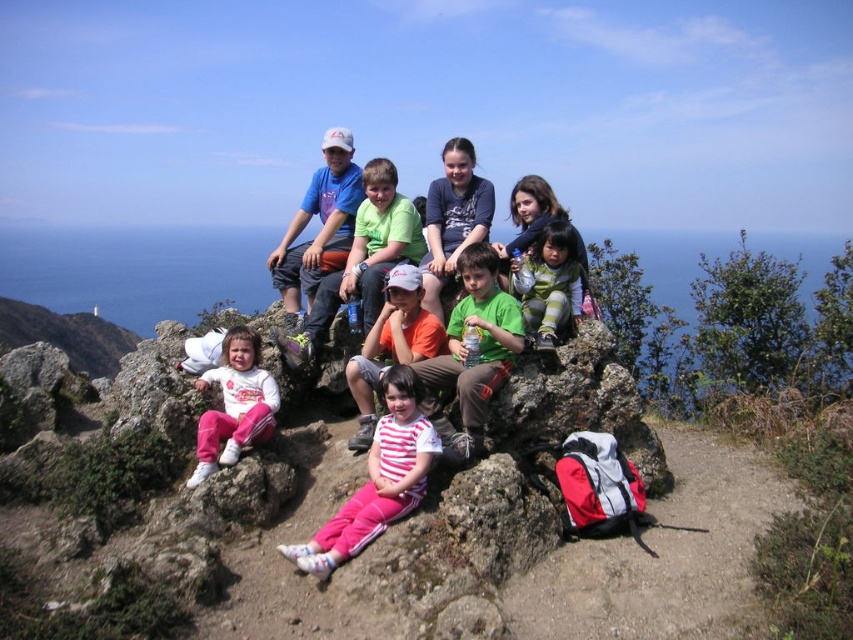
Question: Which object is positioned closest to the striped fabric pants at center?

Choices:
 (A) matte green shirt at center
 (B) green fabric jacket at center
 (C) white fleece pants at lower left

Answer: (C)

Question: Can you confirm if matte green shirt at center is positioned below striped cotton shirt at center?

Choices:
 (A) no
 (B) yes

Answer: (A)

Question: Based on their relative distances, which object is farther from the white fleece pants at lower left?

Choices:
 (A) striped cotton shirt at center
 (B) striped fabric pants at center
 (C) green matte shirt at center
 (D) matte green shirt at center

Answer: (C)

Question: Is matte green shirt at center positioned at the back of green matte shirt at center?

Choices:
 (A) no
 (B) yes

Answer: (B)

Question: From the image, what is the correct spatial relationship of matte green shirt at center in relation to green matte shirt at center?

Choices:
 (A) below
 (B) above

Answer: (B)

Question: Which is nearer to the striped cotton shirt at center?

Choices:
 (A) green matte shirt at center
 (B) matte green shirt at center
 (C) white fleece pants at lower left

Answer: (A)